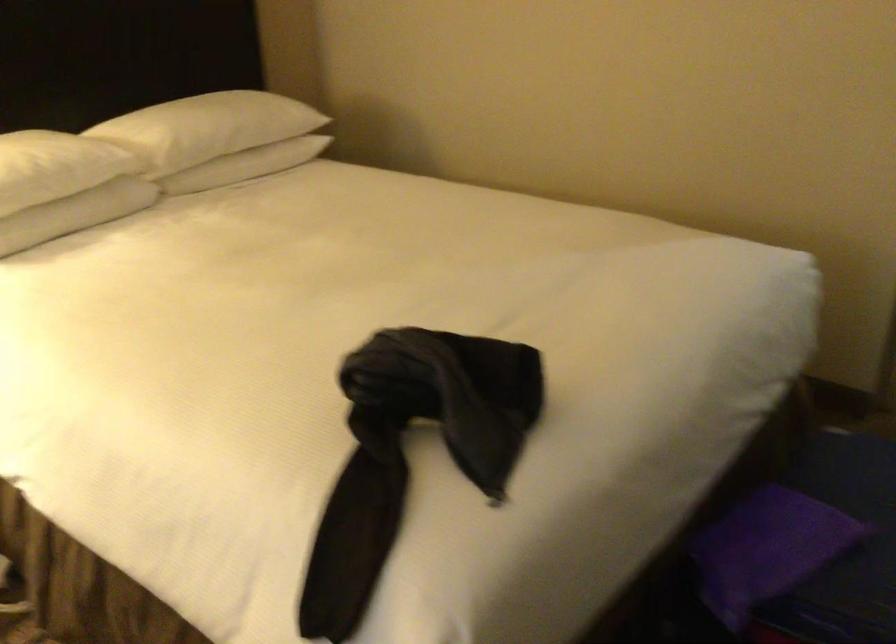
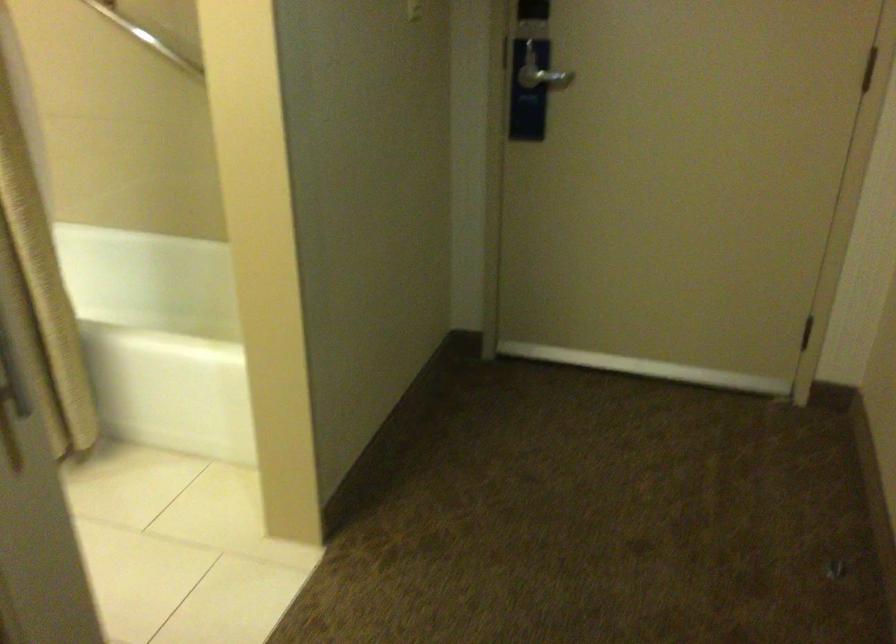
What movement of the cameraman would produce the second image?

The movement direction of the cameraman is right, forward.